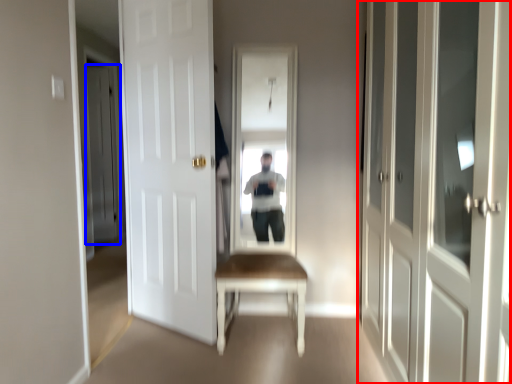
Question: Which of the following is the farthest to the observer, door (highlighted by a red box) or door (highlighted by a blue box)?

Choices:
 (A) door
 (B) door

Answer: (B)